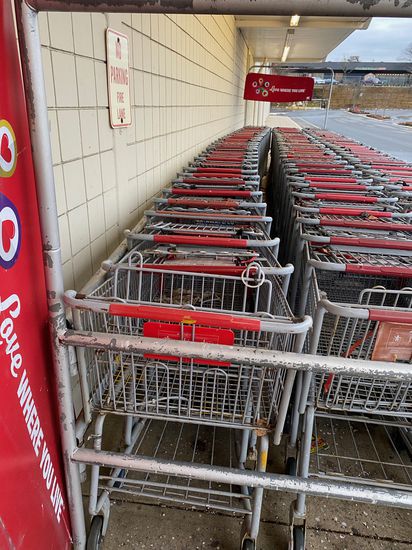
Locate an element on the screen. This screenshot has height=550, width=412. trolley is located at coordinates (204, 421).